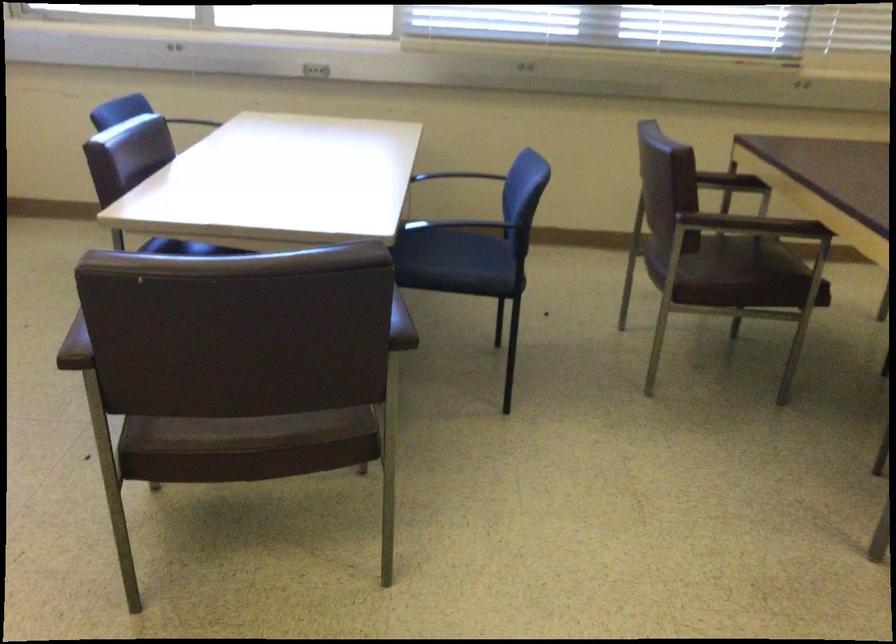
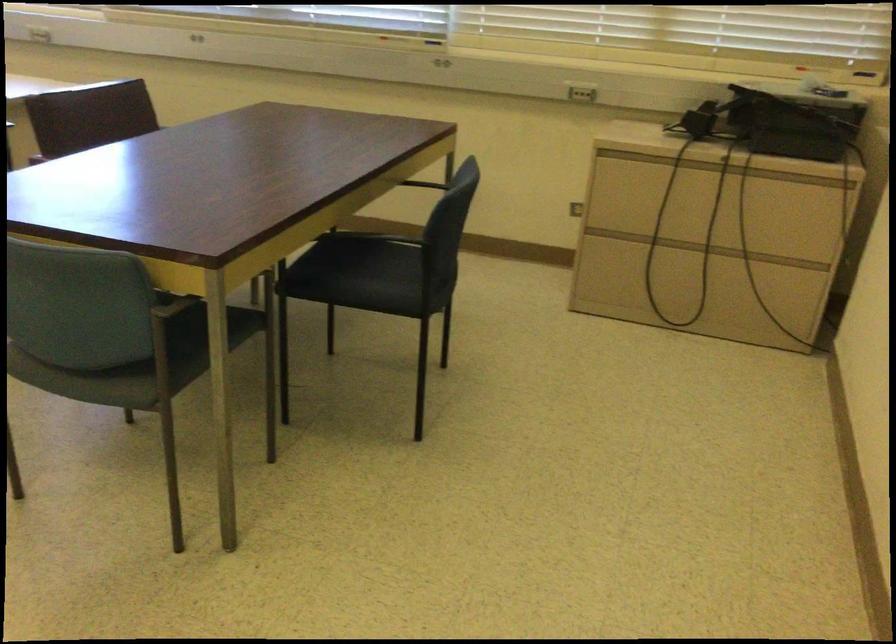
Question: I am providing you with two images of the same scene from different viewpoints. Please identify which objects are invisible in image2.

Choices:
 (A) white whiteboard magnet
 (B) brown chair sitting surface
 (C) black chair sitting surface
 (D) cabinet drawer handle

Answer: (B)